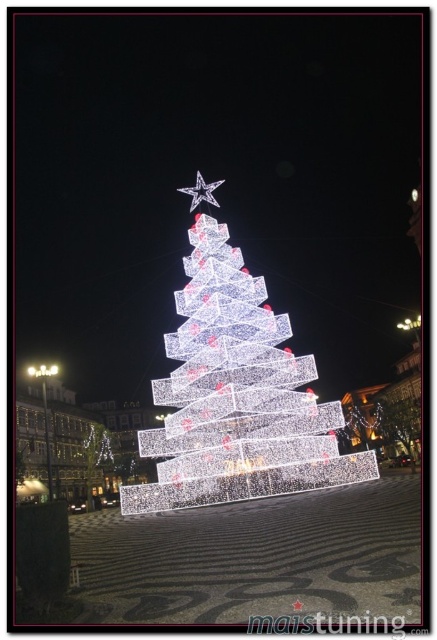
Question: Is illuminated wireframe at center to the left of illuminated wireframe tree at center from the viewer's perspective?

Choices:
 (A) no
 (B) yes

Answer: (A)

Question: Which of the following is the closest to the observer?

Choices:
 (A) illuminated wireframe tree at center
 (B) metallic silver star at upper center
 (C) illuminated wireframe at center

Answer: (C)

Question: Is illuminated wireframe at center thinner than metallic silver star at upper center?

Choices:
 (A) yes
 (B) no

Answer: (B)

Question: Which of the following is the closest to the observer?

Choices:
 (A) (200, 193)
 (B) (83, 456)

Answer: (B)

Question: Which point is farther to the camera?

Choices:
 (A) metallic silver star at upper center
 (B) illuminated wireframe tree at center
 (C) illuminated wireframe at center

Answer: (A)

Question: Is illuminated wireframe at center further to camera compared to illuminated wireframe tree at center?

Choices:
 (A) no
 (B) yes

Answer: (A)